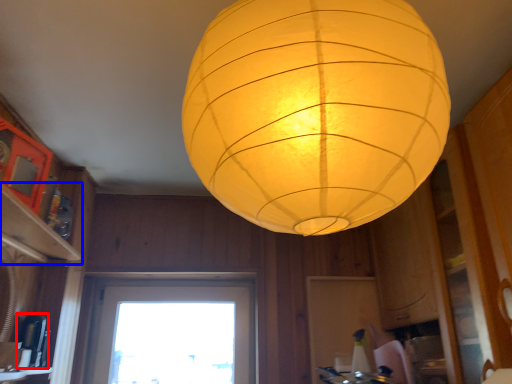
Question: Which point is further to the camera, appliance (highlighted by a red box) or shelf (highlighted by a blue box)?

Choices:
 (A) appliance
 (B) shelf

Answer: (A)